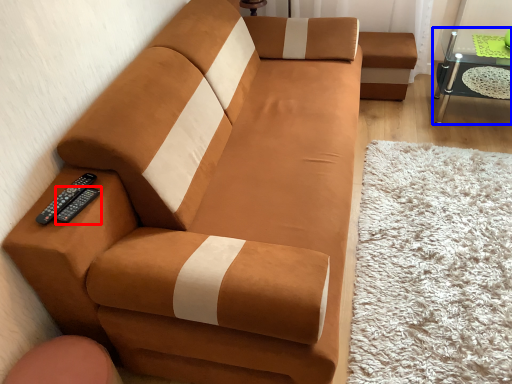
Question: Which point is closer to the camera, remote (highlighted by a red box) or table (highlighted by a blue box)?

Choices:
 (A) remote
 (B) table

Answer: (A)